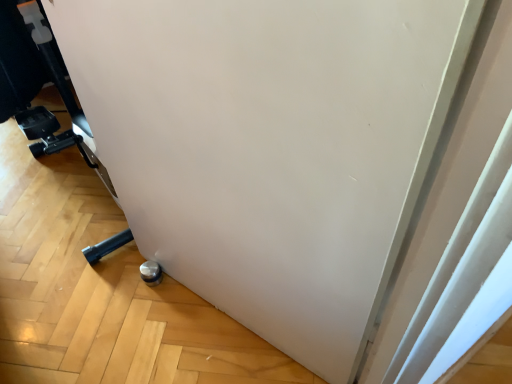
Question: From the image's perspective, would you say metallic silver caster at lower left is shown under metallic silver wheel at lower left?

Choices:
 (A) no
 (B) yes

Answer: (A)

Question: From a real-world perspective, is metallic silver caster at lower left physically below metallic silver wheel at lower left?

Choices:
 (A) yes
 (B) no

Answer: (B)

Question: Is metallic silver caster at lower left oriented away from metallic silver wheel at lower left?

Choices:
 (A) yes
 (B) no

Answer: (A)

Question: Are metallic silver caster at lower left and metallic silver wheel at lower left far apart?

Choices:
 (A) yes
 (B) no

Answer: (B)

Question: Is the position of metallic silver caster at lower left more distant than that of metallic silver wheel at lower left?

Choices:
 (A) no
 (B) yes

Answer: (A)

Question: Can you confirm if metallic silver caster at lower left is smaller than metallic silver wheel at lower left?

Choices:
 (A) no
 (B) yes

Answer: (A)

Question: Considering the relative positions of metallic silver wheel at lower left and metallic silver caster at lower left in the image provided, is metallic silver wheel at lower left to the right of metallic silver caster at lower left from the viewer's perspective?

Choices:
 (A) yes
 (B) no

Answer: (A)

Question: From a real-world perspective, is metallic silver wheel at lower left below metallic silver caster at lower left?

Choices:
 (A) yes
 (B) no

Answer: (A)

Question: Does metallic silver wheel at lower left have a greater height compared to metallic silver caster at lower left?

Choices:
 (A) no
 (B) yes

Answer: (A)

Question: Can you confirm if metallic silver wheel at lower left is shorter than metallic silver caster at lower left?

Choices:
 (A) no
 (B) yes

Answer: (B)

Question: Can you confirm if metallic silver wheel at lower left is bigger than metallic silver caster at lower left?

Choices:
 (A) no
 (B) yes

Answer: (A)

Question: Does metallic silver wheel at lower left come behind metallic silver caster at lower left?

Choices:
 (A) yes
 (B) no

Answer: (A)

Question: From the image's perspective, relative to metallic silver caster at lower left, is metallic silver wheel at lower left above or below?

Choices:
 (A) below
 (B) above

Answer: (A)